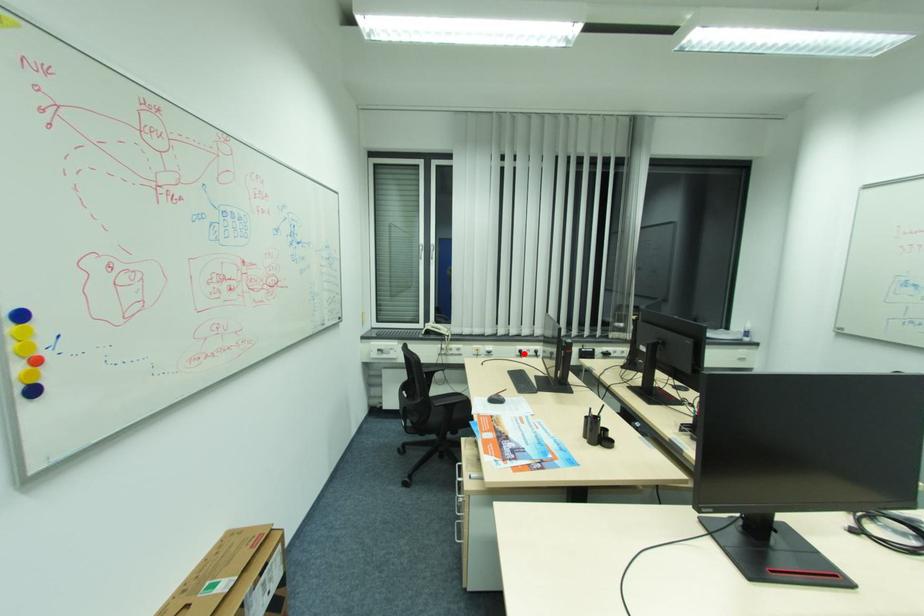
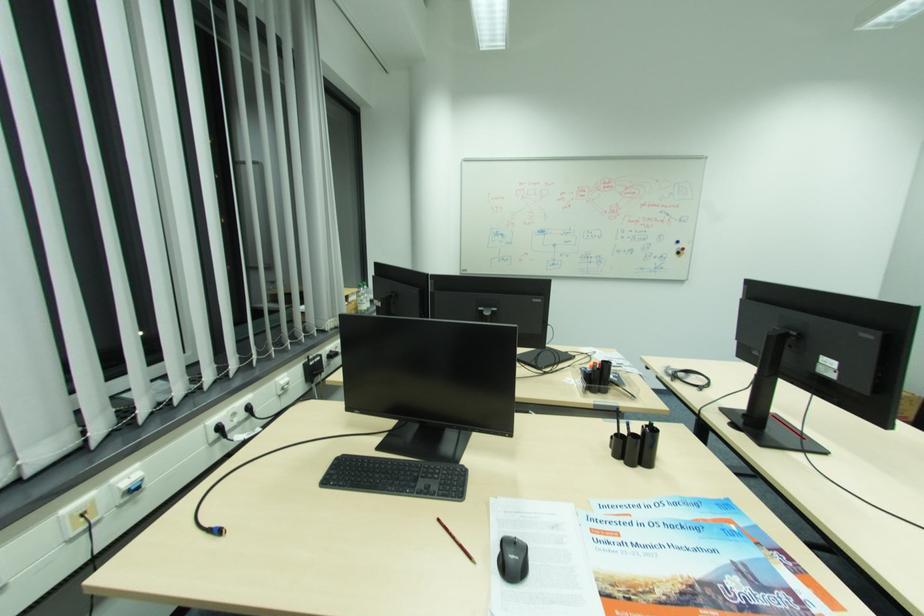
Find the pixel in the second image that matches the highlighted location in the first image.

(220, 436)